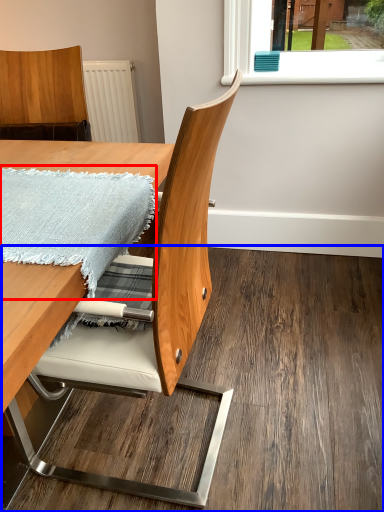
Question: Which object appears closest to the camera in this image, blanket (highlighted by a red box) or plywood (highlighted by a blue box)?

Choices:
 (A) blanket
 (B) plywood

Answer: (A)